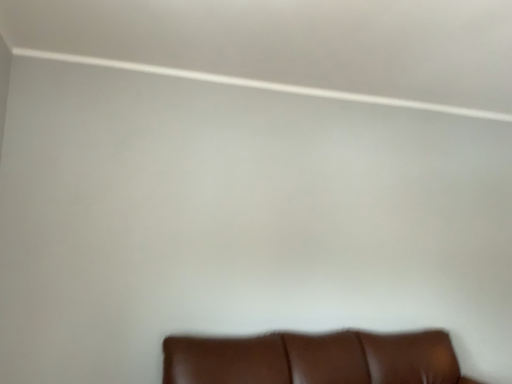
The height and width of the screenshot is (384, 512). Describe the element at coordinates (314, 359) in the screenshot. I see `brown leather couch at lower center` at that location.

Where is `brown leather couch at lower center`? The width and height of the screenshot is (512, 384). brown leather couch at lower center is located at coordinates (314, 359).

Where is `brown leather couch at lower center`? The height and width of the screenshot is (384, 512). brown leather couch at lower center is located at coordinates (314, 359).